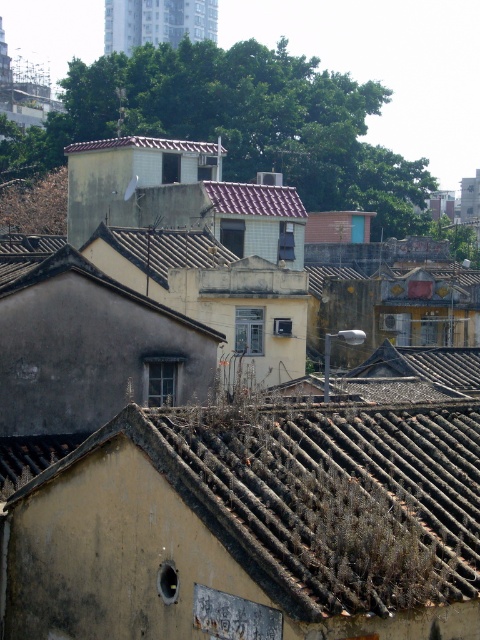
Does brown textured tile roof at lower center appear under brown tile roof at upper center?

Correct, brown textured tile roof at lower center is located below brown tile roof at upper center.

Can you confirm if brown textured tile roof at lower center is positioned above brown tile roof at upper center?

Actually, brown textured tile roof at lower center is below brown tile roof at upper center.

The height and width of the screenshot is (640, 480). Describe the element at coordinates (262, 515) in the screenshot. I see `brown textured tile roof at lower center` at that location.

Identify the location of brown textured tile roof at lower center. (262, 515).